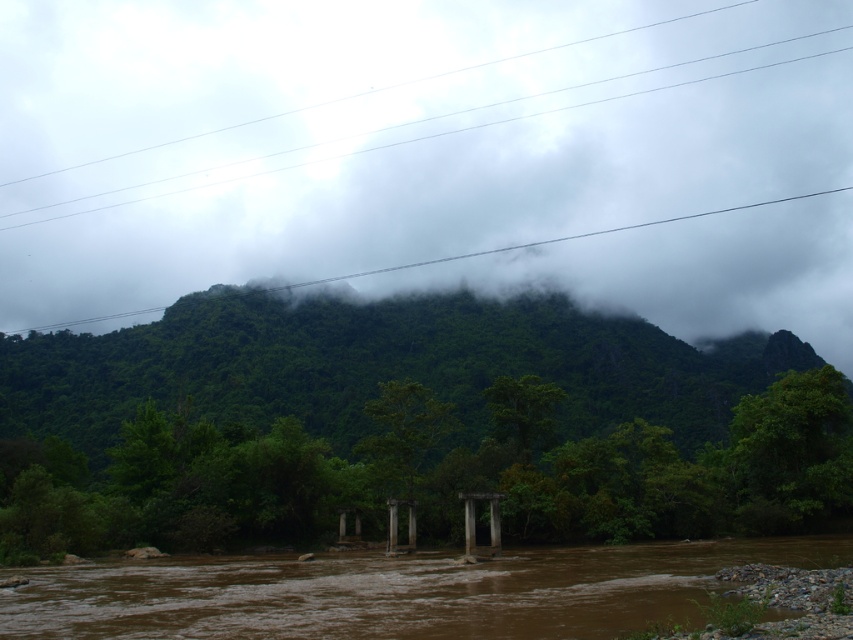
You are a hiker navigating a map of the landscape shown. The map has coordinates marked from 0 to 1 on both axes. You need to locate the green leafy hillside at upper center. What are its coordinates?

The green leafy hillside at upper center is located at coordinates point (445, 168).

You are a hiker trying to cross the brown muddy water at center. You notice the green leafy hillside at upper center in the distance. Which object would you prioritize checking for stability before proceeding?

The green leafy hillside at upper center has a larger size compared to brown muddy water at center, so you should prioritize checking the stability of the green leafy hillside at upper center first because its larger size might indicate a stronger foundation.